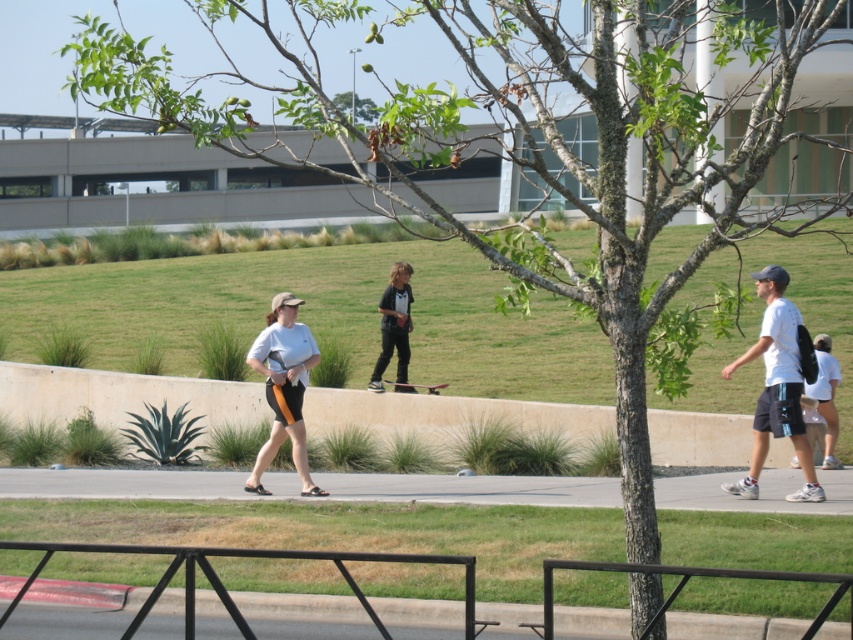
Question: Which point appears farthest from the camera in this image?

Choices:
 (A) (299, 449)
 (B) (764, 486)
 (C) (467, 637)
 (D) (433, 392)

Answer: (D)

Question: Can you confirm if white matte shorts at center is bigger than black matte skateboard at center?

Choices:
 (A) yes
 (B) no

Answer: (B)

Question: Considering the relative positions of white matte t-shirt at right and black matte skateboard at center in the image provided, where is white matte t-shirt at right located with respect to black matte skateboard at center?

Choices:
 (A) below
 (B) above

Answer: (A)

Question: Which of the following is the closest to the observer?

Choices:
 (A) (131, 634)
 (B) (241, 477)

Answer: (A)

Question: Is white matte t-shirt at right to the right of dark red wood skateboard at center from the viewer's perspective?

Choices:
 (A) no
 (B) yes

Answer: (B)

Question: Which point is farther from the camera taking this photo?

Choices:
 (A) (206, 499)
 (B) (264, 445)
 (C) (752, 452)
 (D) (387, 333)

Answer: (D)